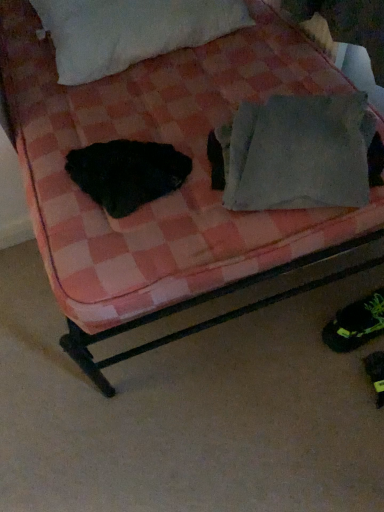
Find the location of a particular element. The width and height of the screenshot is (384, 512). free spot behind green synthetic shoe at lower right is located at coordinates (326, 288).